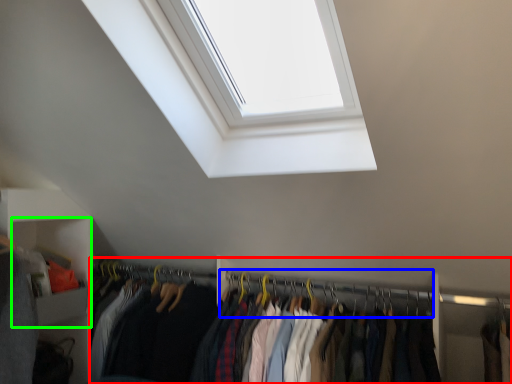
Question: Based on their relative distances, which object is farther from closet (highlighted by a red box)? Choose from hanger (highlighted by a blue box) and cabinet (highlighted by a green box).

Choices:
 (A) hanger
 (B) cabinet

Answer: (B)